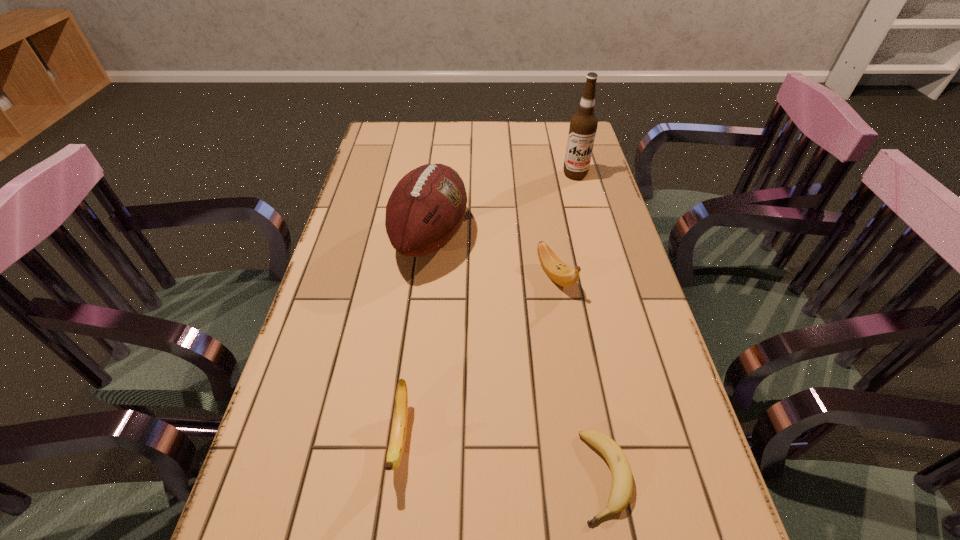
Locate an element on the screen. The width and height of the screenshot is (960, 540). free space between the fourth shortest object and the farthest banana is located at coordinates (493, 256).

Locate an element on the screen. free spot between the football (American) and the leftmost banana is located at coordinates (416, 338).

The image size is (960, 540). In order to click on vacant region between the tallest object and the second tallest object in this screenshot , I will do `click(503, 206)`.

I want to click on blank region between the fourth shortest object and the farthest banana, so coord(493,256).

In order to click on object that is the second closest to the football (American) in this screenshot , I will do `click(583, 126)`.

This screenshot has width=960, height=540. What are the coordinates of `object that ranks as the third closest to the tallest object` in the screenshot? It's located at (622, 480).

Identify which banana is the nearest to the shortest banana. Please provide its 2D coordinates. Your answer should be formatted as a tuple, i.e. [(x, y)], where the tuple contains the x and y coordinates of a point satisfying the conditions above.

[(399, 427)]

The height and width of the screenshot is (540, 960). I want to click on banana object that ranks as the second closest to the shortest object, so click(x=562, y=274).

Locate an element on the screen. vacant space that satisfies the following two spatial constraints: 1. on the front side of the farthest banana; 2. on the left side of the football (American) is located at coordinates tap(426, 276).